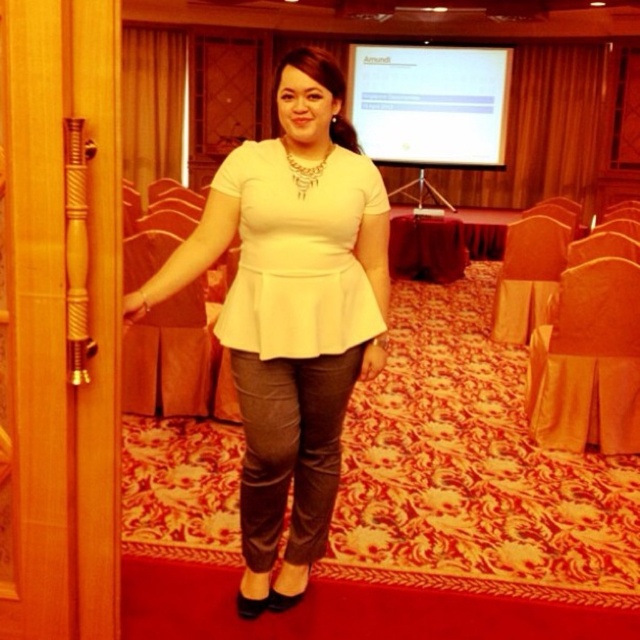
Where is `matte white blouse at center`? Image resolution: width=640 pixels, height=640 pixels. matte white blouse at center is located at coordinates (291, 312).

Which is more to the left, matte white blouse at center or white matte peplum top at center?

From the viewer's perspective, matte white blouse at center appears more on the left side.

Is point (252, 483) closer to viewer compared to point (253, 346)?

No, it is behind (253, 346).

Find the location of a particular element. Image resolution: width=640 pixels, height=640 pixels. matte white blouse at center is located at coordinates (291, 312).